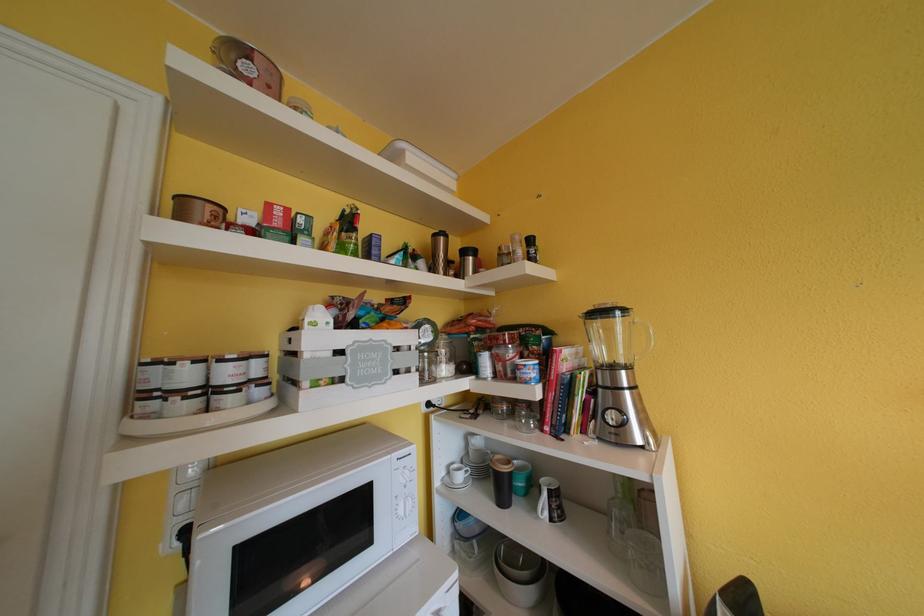
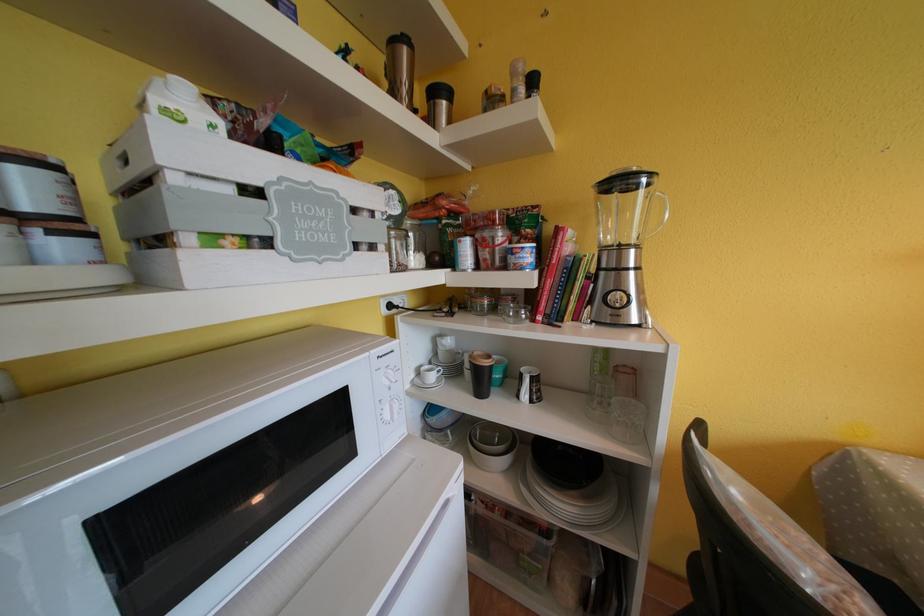
Where in the second image is the point corresponding to point 469,256 from the first image?

(440, 95)